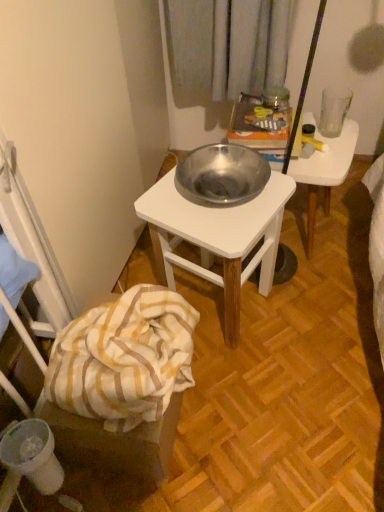
This screenshot has width=384, height=512. What do you see at coordinates (334, 110) in the screenshot?
I see `transparent glass at upper right` at bounding box center [334, 110].

The width and height of the screenshot is (384, 512). Describe the element at coordinates (115, 441) in the screenshot. I see `yellow striped fabric at lower left` at that location.

Measure the distance between metallic white table at center and camera.

A distance of 35.71 inches exists between metallic white table at center and camera.

In the scene shown: What is the approximate height of metallic white table at center?

metallic white table at center is 17.75 inches in height.

Locate an element on the screen. The image size is (384, 512). metallic silver bowl at center is located at coordinates (324, 170).

What do you see at coordinates (324, 170) in the screenshot?
I see `metallic silver bowl at center` at bounding box center [324, 170].

Locate an element on the screen. The width and height of the screenshot is (384, 512). transparent glass at upper right is located at coordinates click(x=334, y=110).

The width and height of the screenshot is (384, 512). Identify the location of blanket in front of the metallic silver bowl at center. (124, 358).

Do you think white striped fabric at lower left is within metallic silver bowl at center, or outside of it?

white striped fabric at lower left is spatially situated outside metallic silver bowl at center.

Considering the positions of point (149, 343) and point (289, 172), is point (149, 343) closer or farther from the camera than point (289, 172)?

Clearly, point (149, 343) is closer to the camera than point (289, 172).

Are white striped fabric at lower left and metallic silver bowl at center making contact?

white striped fabric at lower left and metallic silver bowl at center are clearly separated.

From the image's perspective, which is below, metallic silver bowl at center or metallic white table at center?

metallic white table at center, from the image's perspective.

Is metallic silver bowl at center oriented towards metallic white table at center?

No, metallic silver bowl at center does not turn towards metallic white table at center.

Is metallic silver bowl at center not inside metallic white table at center?

Yes, metallic silver bowl at center is not within metallic white table at center.

Is metallic silver bowl at center at the back of yellow striped fabric at lower left?

That's not correct — yellow striped fabric at lower left is not looking away from metallic silver bowl at center.

Considering the sizes of objects yellow striped fabric at lower left and metallic silver bowl at center in the image provided, who is shorter, yellow striped fabric at lower left or metallic silver bowl at center?

With less height is yellow striped fabric at lower left.

Does yellow striped fabric at lower left have a greater width compared to metallic silver bowl at center?

No, yellow striped fabric at lower left is not wider than metallic silver bowl at center.

From the image's perspective, relative to metallic silver bowl at center, is yellow striped fabric at lower left above or below?

Clearly, from the image's perspective, yellow striped fabric at lower left is below metallic silver bowl at center.

Between point (66, 387) and point (177, 402), which one is positioned behind?

The point (177, 402) is farther.

Which of these two, white striped fabric at lower left or yellow striped fabric at lower left, is thinner?

yellow striped fabric at lower left.

Which object is positioned more to the right, white striped fabric at lower left or yellow striped fabric at lower left?

white striped fabric at lower left.

Can you tell me how much white striped fabric at lower left and yellow striped fabric at lower left differ in facing direction?

There is a 2.41-degree angle between the facing directions of white striped fabric at lower left and yellow striped fabric at lower left.

Is yellow striped fabric at lower left oriented away from metallic white table at center?

That's not correct — yellow striped fabric at lower left is not looking away from metallic white table at center.

Who is shorter, yellow striped fabric at lower left or metallic white table at center?

yellow striped fabric at lower left.

How different are the orientations of yellow striped fabric at lower left and metallic white table at center in degrees?

The facing directions of yellow striped fabric at lower left and metallic white table at center are 27 degrees apart.

Which is more to the right, yellow striped fabric at lower left or metallic white table at center?

Positioned to the right is metallic white table at center.

Is metallic white table at center facing away from yellow striped fabric at lower left?

That's not correct — metallic white table at center is not looking away from yellow striped fabric at lower left.

Is the position of metallic white table at center more distant than that of yellow striped fabric at lower left?

Yes, it is behind yellow striped fabric at lower left.

From a real-world perspective, is metallic white table at center physically located above or below yellow striped fabric at lower left?

In terms of real-world spatial position, metallic white table at center is above yellow striped fabric at lower left.

Which object is thinner, metallic white table at center or yellow striped fabric at lower left?

yellow striped fabric at lower left is thinner.

From a real-world perspective, is metallic white table at center positioned over metallic silver bowl at center based on gravity?

Yes, from a real-world perspective, metallic white table at center is on top of metallic silver bowl at center.

What's the angular difference between metallic white table at center and metallic silver bowl at center's facing directions?

12.9 degrees.

Would you say metallic white table at center is a long distance from metallic silver bowl at center?

No.

Between metallic white table at center and metallic silver bowl at center, which one has more height?

metallic white table at center.

Where is `blanket that is above the metallic silver bowl at center (from a real-world perspective)`? blanket that is above the metallic silver bowl at center (from a real-world perspective) is located at coordinates (124, 358).

This screenshot has width=384, height=512. Find the location of `table below the metallic white table at center (from a real-world perspective)`. table below the metallic white table at center (from a real-world perspective) is located at coordinates (324, 170).

Estimate the real-world distances between objects in this image. Which object is further from yellow striped fabric at lower left, metallic white table at center or metallic silver bowl at center?

metallic silver bowl at center lies further to yellow striped fabric at lower left than the other object.

Based on their spatial positions, is white striped fabric at lower left or yellow striped fabric at lower left closer to metallic white table at center?

white striped fabric at lower left.

Considering their positions, is metallic white table at center positioned closer to metallic silver bowl at center than white striped fabric at lower left?

Result: metallic white table at center lies closer to metallic silver bowl at center than the other object.

Consider the image. Looking at the image, which one is located further to white striped fabric at lower left, metallic white table at center or transparent glass at upper right?

transparent glass at upper right.

When comparing their distances from metallic white table at center, does metallic silver bowl at center or white striped fabric at lower left seem further?

metallic silver bowl at center lies further to metallic white table at center than the other object.

Which object lies further to the anchor point yellow striped fabric at lower left, transparent glass at upper right or metallic silver bowl at center?

Among the two, transparent glass at upper right is located further to yellow striped fabric at lower left.

Considering their positions, is transparent glass at upper right positioned further to metallic silver bowl at center than yellow striped fabric at lower left?

yellow striped fabric at lower left is further to metallic silver bowl at center.

Which object lies nearer to the anchor point yellow striped fabric at lower left, white striped fabric at lower left or metallic white table at center?

Among the two, white striped fabric at lower left is located nearer to yellow striped fabric at lower left.

Locate an element on the screen. desk that lies between transparent glass at upper right and yellow striped fabric at lower left from top to bottom is located at coordinates (217, 238).

Identify the location of desk that lies between metallic silver bowl at center and yellow striped fabric at lower left from top to bottom. The width and height of the screenshot is (384, 512). (217, 238).

Where is `blanket between yellow striped fabric at lower left and metallic silver bowl at center`? Image resolution: width=384 pixels, height=512 pixels. blanket between yellow striped fabric at lower left and metallic silver bowl at center is located at coordinates (124, 358).

This screenshot has height=512, width=384. What are the coordinates of `desk between transparent glass at upper right and white striped fabric at lower left from top to bottom` in the screenshot? It's located at (217, 238).